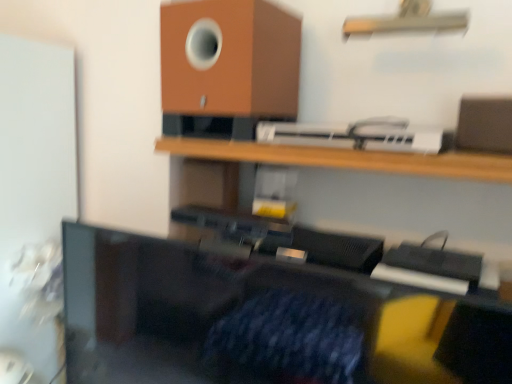
Question: Is brown matte speaker at upper center behind white plastic printer at upper center?

Choices:
 (A) no
 (B) yes

Answer: (B)

Question: Is brown matte speaker at upper center facing towards white plastic printer at upper center?

Choices:
 (A) no
 (B) yes

Answer: (A)

Question: Is brown matte speaker at upper center bigger than white plastic printer at upper center?

Choices:
 (A) no
 (B) yes

Answer: (B)

Question: From a real-world perspective, is brown matte speaker at upper center under white plastic printer at upper center?

Choices:
 (A) no
 (B) yes

Answer: (A)

Question: Does brown matte speaker at upper center have a greater width compared to white plastic printer at upper center?

Choices:
 (A) no
 (B) yes

Answer: (B)

Question: From a real-world perspective, is wooden shelf at upper center, the first shelf ordered from the bottom, physically located above or below brown matte speaker at upper center?

Choices:
 (A) below
 (B) above

Answer: (A)

Question: Is wooden shelf at upper center, the first shelf ordered from the bottom, wider or thinner than brown matte speaker at upper center?

Choices:
 (A) wide
 (B) thin

Answer: (A)

Question: Choose the correct answer: Is wooden shelf at upper center, the first shelf ordered from the bottom, inside brown matte speaker at upper center or outside it?

Choices:
 (A) inside
 (B) outside

Answer: (B)

Question: From the image's perspective, relative to brown matte speaker at upper center, is wooden shelf at upper center, the second shelf positioned from the top, above or below?

Choices:
 (A) above
 (B) below

Answer: (B)

Question: Choose the correct answer: Is wooden shelf at upper center, the first shelf ordered from the bottom, inside metallic silver shelf at upper center, positioned as the 1th shelf in top-to-bottom order, or outside it?

Choices:
 (A) outside
 (B) inside

Answer: (A)

Question: From a real-world perspective, is wooden shelf at upper center, the second shelf positioned from the top, positioned above or below metallic silver shelf at upper center, positioned as the 1th shelf in top-to-bottom order?

Choices:
 (A) below
 (B) above

Answer: (A)

Question: In the image, is wooden shelf at upper center, the first shelf ordered from the bottom, positioned in front of or behind metallic silver shelf at upper center, positioned as the 1th shelf in top-to-bottom order?

Choices:
 (A) front
 (B) behind

Answer: (A)

Question: Does point (412, 157) appear closer or farther from the camera than point (349, 23)?

Choices:
 (A) closer
 (B) farther

Answer: (A)

Question: In the image, is brown matte speaker at upper center on the left side or the right side of wooden shelf at upper center, the first shelf ordered from the bottom?

Choices:
 (A) left
 (B) right

Answer: (A)

Question: Considering the positions of brown matte speaker at upper center and wooden shelf at upper center, the second shelf positioned from the top, in the image, is brown matte speaker at upper center taller or shorter than wooden shelf at upper center, the second shelf positioned from the top,?

Choices:
 (A) tall
 (B) short

Answer: (A)